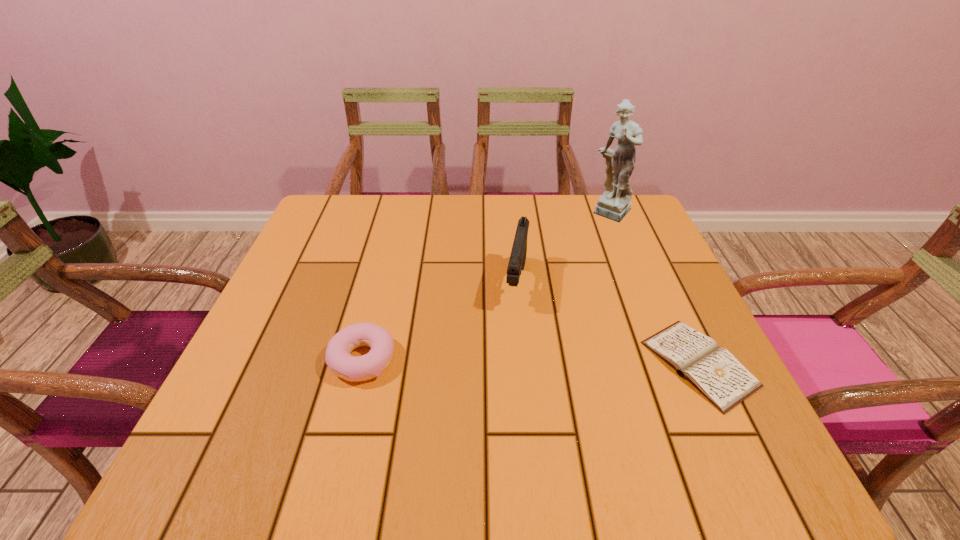
Where is `object situated at the far right corner`? object situated at the far right corner is located at coordinates (614, 204).

I want to click on object that is at the near right corner, so click(x=714, y=371).

The width and height of the screenshot is (960, 540). In order to click on free space at the far edge of the desktop in this screenshot , I will do `click(438, 225)`.

Where is `vacant region at the near edge of the desktop`? The width and height of the screenshot is (960, 540). vacant region at the near edge of the desktop is located at coordinates point(525,392).

Find the location of a particular element. This screenshot has height=540, width=960. vacant space at the left edge is located at coordinates (327, 325).

You are a GUI agent. You are given a task and a screenshot of the screen. Output one action in this format:
    pyautogui.click(x=<x>, y=<y>)
    Task: Click on the free space at the right edge of the desktop
    This screenshot has width=960, height=540.
    Given the screenshot: What is the action you would take?
    pyautogui.click(x=648, y=313)

In the image, there is a desktop. Where is `blank space at the far left corner`? blank space at the far left corner is located at coordinates (330, 208).

At what (x,y) coordinates should I click in order to perform the action: click on free space at the far right corner. Please return your answer as a coordinate pair (x, y). The height and width of the screenshot is (540, 960). Looking at the image, I should click on (636, 217).

Image resolution: width=960 pixels, height=540 pixels. I want to click on vacant space at the near right corner, so click(741, 418).

The height and width of the screenshot is (540, 960). What are the coordinates of `free space between the second farthest object and the farthest object` in the screenshot? It's located at (564, 248).